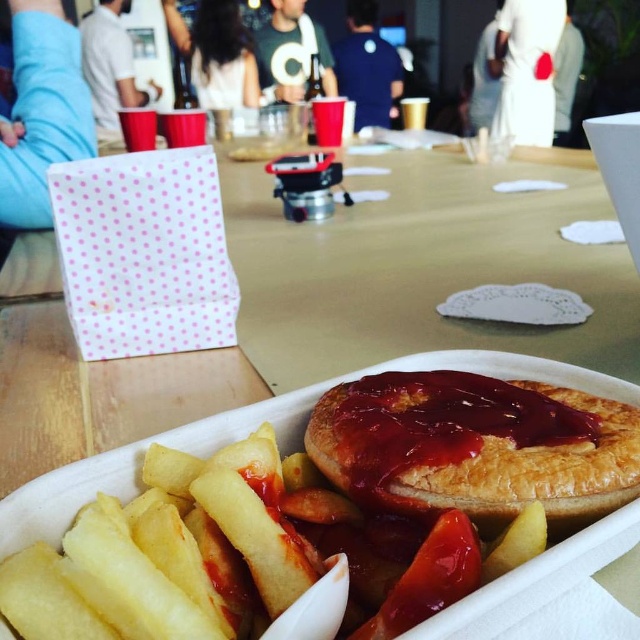
From the picture: You are a food delivery driver who needs to know if the golden crispy french fries at lower left can fit into a container designed for the golden flaky pie at center. Based on their sizes, can they?

The golden crispy french fries at lower left has a smaller size compared to golden flaky pie at center, so yes, the golden crispy french fries at lower left can fit into a container designed for the golden flaky pie at center since it is smaller in size.

You are a food delivery person who needs to place a hot beverage in the disposable cups on the table. The beverage is too hot to touch, so you must use the small white plastic spoon resting on the side of the tray to move it. However, the spoon is currently near the golden crispy french fries at lower left. Can you reach the disposable cups without moving the french fries?

The golden crispy french fries at lower left is located at point [163,554], so the disposable cups are likely positioned away from this area, allowing you to move the spoon to the cups without disturbing the fries.

You are a food delivery person who needs to decide whether to place the golden crispy french fries at lower left and the golden flaky pie at center into a narrow container. The container can only hold items up to the thickness of the thinner object. Which item determines the maximum thickness allowed?

The golden crispy french fries at lower left is thinner than the golden flaky pie at center, so the maximum thickness allowed in the container must be determined by the thickness of the golden crispy french fries at lower left.